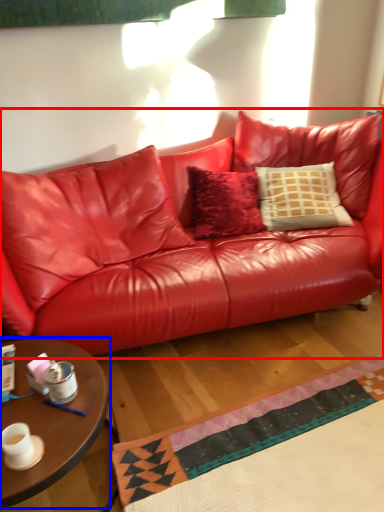
Question: Which object is further to the camera taking this photo, studio couch (highlighted by a red box) or coffee table (highlighted by a blue box)?

Choices:
 (A) studio couch
 (B) coffee table

Answer: (A)